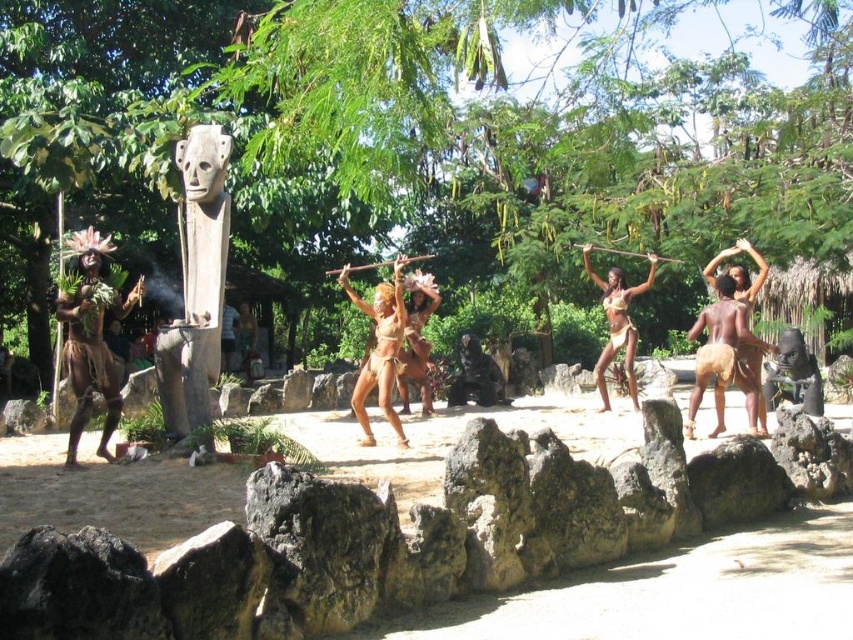
Question: Can you confirm if brown textured grass skirt at left is bigger than brown leather skirt at center?

Choices:
 (A) no
 (B) yes

Answer: (B)

Question: Which point is closer to the camera taking this photo?

Choices:
 (A) (357, 380)
 (B) (613, 282)
 (C) (750, 246)

Answer: (C)

Question: Which object is closer to the camera taking this photo?

Choices:
 (A) brown textured grass skirt at left
 (B) brown textured skirt at right
 (C) brown leather skirt at center
 (D) brown textured skin at center

Answer: (A)

Question: Can you confirm if brown textured skin at center is wider than brown textured skirt at right?

Choices:
 (A) no
 (B) yes

Answer: (B)

Question: Considering the relative positions of brown textured grass skirt at left and brown textured skin at center in the image provided, where is brown textured grass skirt at left located with respect to brown textured skin at center?

Choices:
 (A) right
 (B) left

Answer: (B)

Question: Which of the following is the farthest from the observer?

Choices:
 (A) (363, 444)
 (B) (68, 301)

Answer: (A)